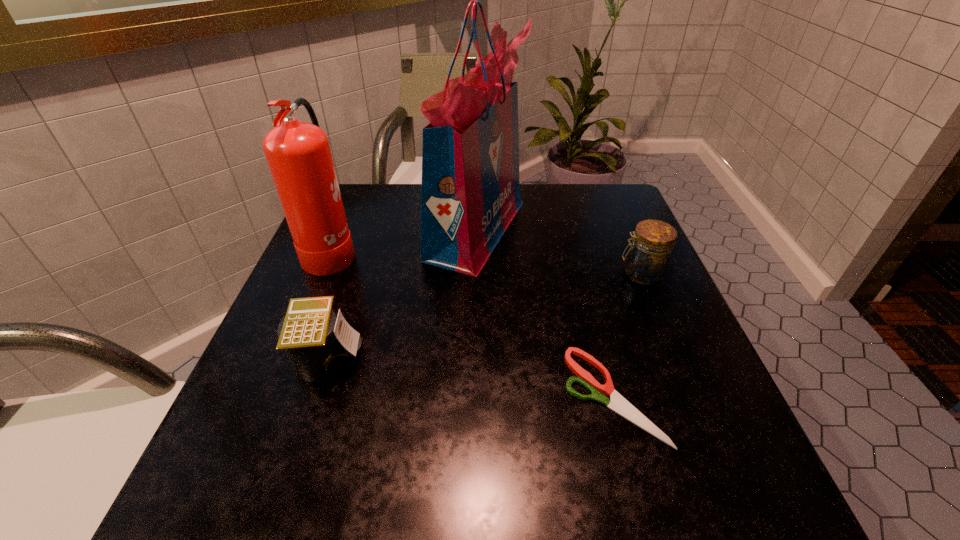
Locate an element on the screen. The height and width of the screenshot is (540, 960). free space between the scissors and the rightmost object is located at coordinates (627, 335).

At what (x,y) coordinates should I click in order to perform the action: click on blank region between the shortest object and the fourth tallest object. Please return your answer as a coordinate pair (x, y). This screenshot has width=960, height=540. Looking at the image, I should click on (470, 377).

Where is `unoccupied position between the fourth tallest object and the tallest object`? Image resolution: width=960 pixels, height=540 pixels. unoccupied position between the fourth tallest object and the tallest object is located at coordinates (402, 294).

At what (x,y) coordinates should I click in order to perform the action: click on vacant region between the third object from left to right and the fire extinguisher. Please return your answer as a coordinate pair (x, y). The image size is (960, 540). Looking at the image, I should click on (404, 240).

The width and height of the screenshot is (960, 540). I want to click on vacant space that's between the third object from left to right and the rightmost object, so pos(559,252).

Point out which object is positioned as the fourth nearest to the fire extinguisher. Please provide its 2D coordinates. Your answer should be formatted as a tuple, i.e. [(x, y)], where the tuple contains the x and y coordinates of a point satisfying the conditions above.

[(647, 260)]

Identify the location of object identified as the third closest to the fourth shortest object. The height and width of the screenshot is (540, 960). (617, 403).

This screenshot has width=960, height=540. I want to click on vacant region that satisfies the following two spatial constraints: 1. towards the nozzle of the fire extinguisher; 2. on the right side of the shortest object, so point(272,395).

Locate an element on the screen. The width and height of the screenshot is (960, 540). free point that satisfies the following two spatial constraints: 1. towards the nozzle of the scissors; 2. on the right side of the fourth shortest object is located at coordinates (272, 395).

Locate an element on the screen. Image resolution: width=960 pixels, height=540 pixels. vacant region that satisfies the following two spatial constraints: 1. towards the nozzle of the second shortest object; 2. on the left side of the second tallest object is located at coordinates (287, 359).